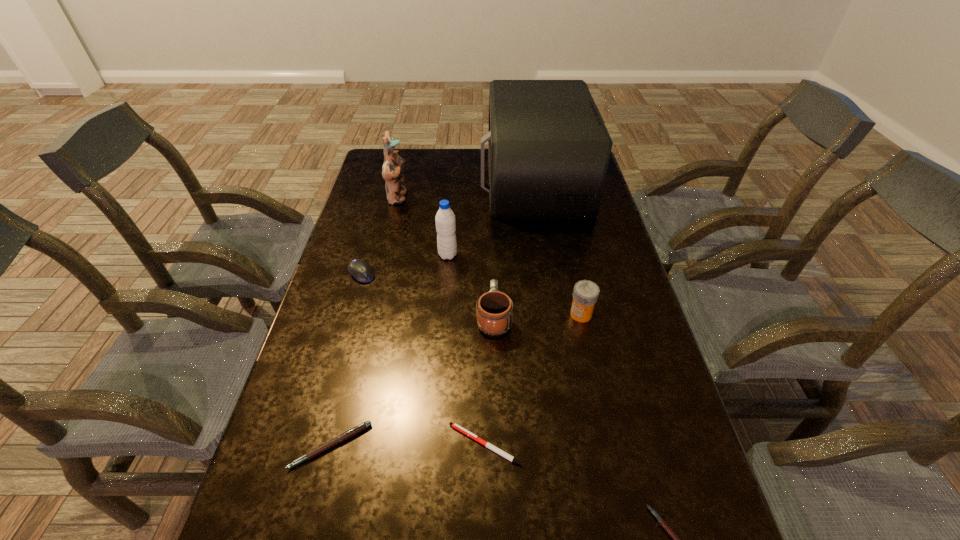
The image size is (960, 540). I want to click on computer mouse situated at the left edge, so click(x=360, y=269).

You are a GUI agent. You are given a task and a screenshot of the screen. Output one action in this format:
    pyautogui.click(x=<x>, y=<y>)
    Task: Click on the pen positioned at the left edge
    The image size is (960, 540).
    Given the screenshot: What is the action you would take?
    pyautogui.click(x=350, y=433)

Find the location of a particular element. Image resolution: width=960 pixels, height=540 pixels. microwave oven that is at the right edge is located at coordinates (549, 149).

At what (x,y) coordinates should I click in order to perform the action: click on medicine present at the right edge. Please return your answer as a coordinate pair (x, y). Looking at the image, I should click on (585, 294).

The width and height of the screenshot is (960, 540). I want to click on object that is at the far right corner, so click(x=549, y=149).

Identify the location of vacant space at the far edge of the desktop. The height and width of the screenshot is (540, 960). (414, 163).

Image resolution: width=960 pixels, height=540 pixels. What are the coordinates of `free region at the left edge` in the screenshot? It's located at (365, 249).

This screenshot has width=960, height=540. Identify the location of vacant point located between the mug and the fourth shortest object. (428, 295).

You are a GUI agent. You are given a task and a screenshot of the screen. Output one action in this format:
    pyautogui.click(x=<x>, y=<y>)
    Task: Click on the empty location between the second tallest object and the second pen from right to left
    This screenshot has height=540, width=960.
    Given the screenshot: What is the action you would take?
    pyautogui.click(x=442, y=321)

I want to click on free point between the fourth farthest object and the figurine, so pyautogui.click(x=380, y=236).